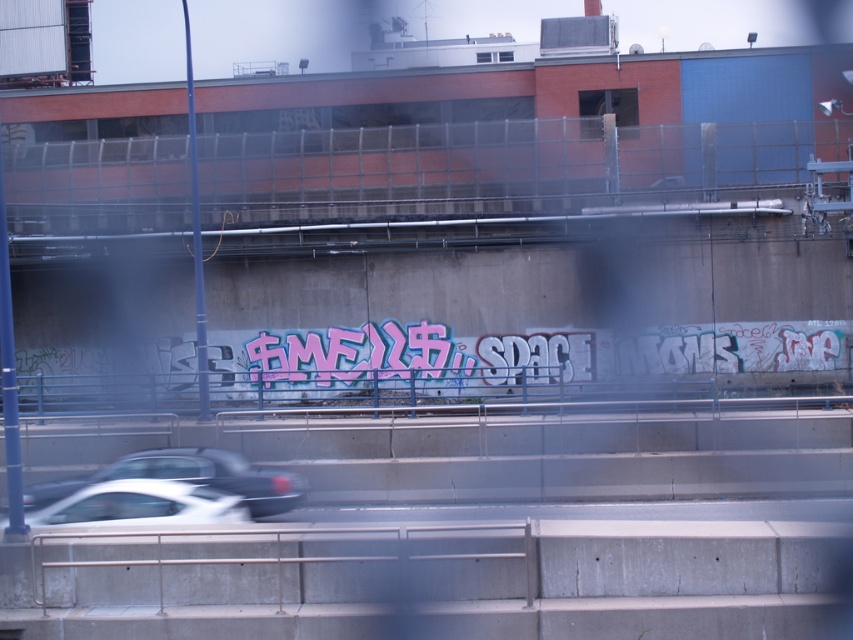
Does blue metal fence at center have a lesser width compared to white glossy car at lower left?

In fact, blue metal fence at center might be wider than white glossy car at lower left.

What are the coordinates of `blue metal fence at center` in the screenshot? It's located at pos(556,392).

The width and height of the screenshot is (853, 640). Find the location of `blue metal fence at center`. blue metal fence at center is located at coordinates (556, 392).

Find the location of a particular element. The image size is (853, 640). blue metal fence at center is located at coordinates click(x=556, y=392).

Between point (171, 474) and point (86, 497), which one is positioned in front?

Point (86, 497) is in front.

Locate an element on the screen. white glossy car at lower left is located at coordinates (189, 477).

Who is shorter, blue metal fence at center or white glossy car at lower center?

white glossy car at lower center

Who is lower down, blue metal fence at center or white glossy car at lower center?

white glossy car at lower center is lower down.

What are the coordinates of `blue metal fence at center` in the screenshot? It's located at (556, 392).